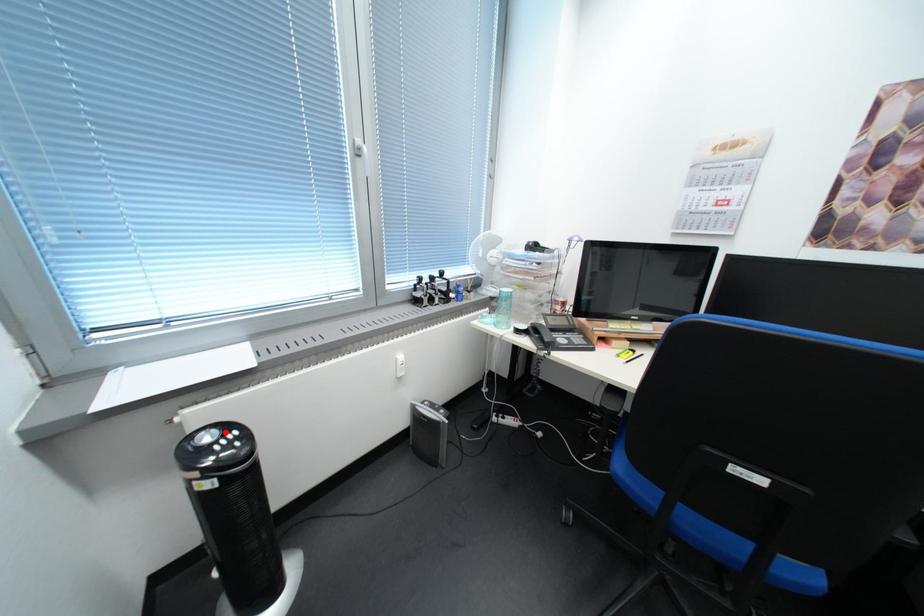
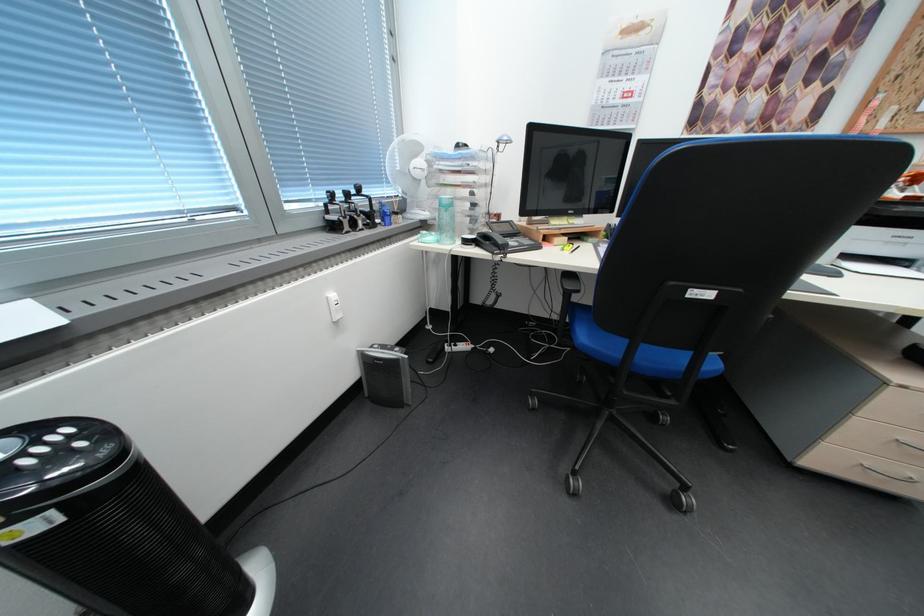
Locate, in the second image, the point that corresponds to the highlighted location in the first image.

(15, 443)